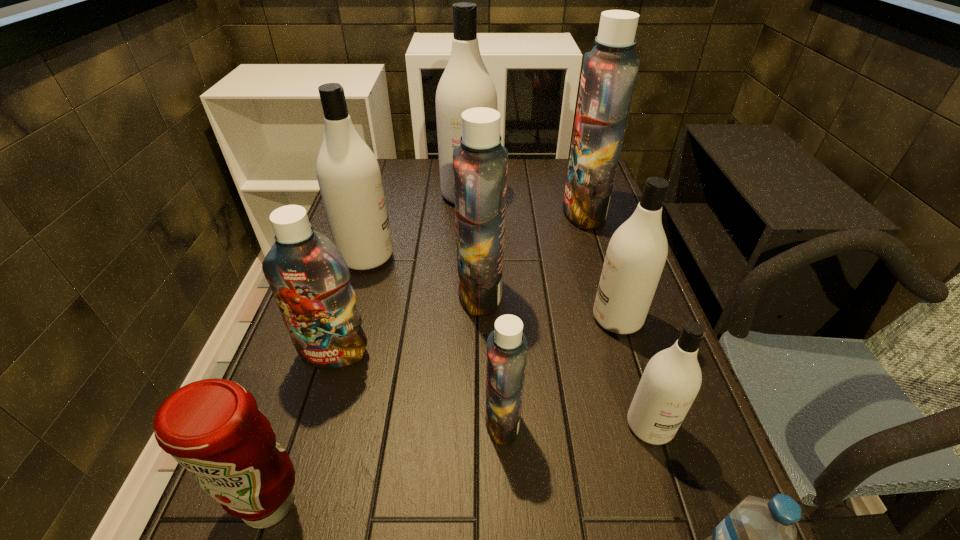
Where is `the second nearest object`? the second nearest object is located at coordinates (212, 427).

Locate an element on the screen. red condiment is located at coordinates (212, 427).

The width and height of the screenshot is (960, 540). I want to click on the nearest blue shampoo, so click(507, 348).

Locate an element on the screen. This screenshot has width=960, height=540. the nearest white shampoo is located at coordinates (672, 378).

Find the location of a particular element. This screenshot has width=960, height=540. vacant point located 0.350m on the front label of the rightmost blue shampoo is located at coordinates (449, 212).

Find the location of a particular element. vacant space located 0.220m on the front label of the rightmost blue shampoo is located at coordinates (492, 212).

The width and height of the screenshot is (960, 540). I want to click on vacant space located on the front label of the rightmost blue shampoo, so click(466, 212).

At what (x,y) coordinates should I click in order to perform the action: click on free point located on the front-facing side of the second white shampoo from left to right. Please return your answer as a coordinate pair (x, y). This screenshot has height=540, width=960. Looking at the image, I should click on (466, 257).

At what (x,y) coordinates should I click in order to perform the action: click on blank space located on the front-facing side of the leftmost white shampoo. Please return your answer as a coordinate pair (x, y). The image size is (960, 540). Looking at the image, I should click on (541, 256).

Locate an element on the screen. Image resolution: width=960 pixels, height=540 pixels. vacant space positioned on the front label of the second farthest blue shampoo is located at coordinates (410, 293).